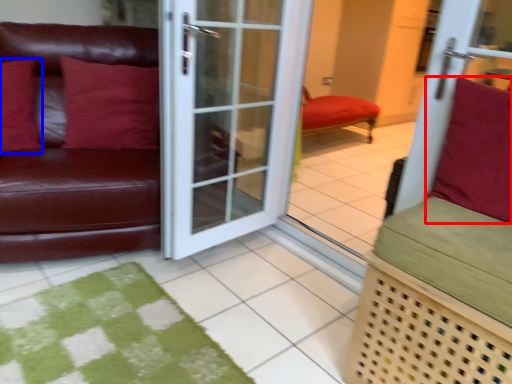
Question: Which object is closer to the camera taking this photo, pillow (highlighted by a red box) or pillow (highlighted by a blue box)?

Choices:
 (A) pillow
 (B) pillow

Answer: (A)